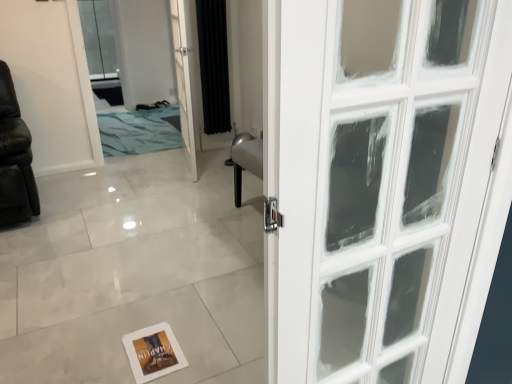
This screenshot has height=384, width=512. Describe the element at coordinates (183, 82) in the screenshot. I see `white glass door at center` at that location.

The width and height of the screenshot is (512, 384). What do you see at coordinates (99, 39) in the screenshot?
I see `clear glass window at upper left` at bounding box center [99, 39].

In order to click on blue fabric bed at upper left in this screenshot , I will do [x=156, y=59].

Identify the location of white paper postcard at lower center. The height and width of the screenshot is (384, 512). (153, 352).

The height and width of the screenshot is (384, 512). In order to click on white glass door at center in this screenshot , I will do `click(183, 82)`.

Is clear glass window at upper left not close to white glass door at center?

Indeed, clear glass window at upper left is not near white glass door at center.

How different are the orientations of clear glass window at upper left and white glass door at center in degrees?

101 degrees separate the facing orientations of clear glass window at upper left and white glass door at center.

Between clear glass window at upper left and white glass door at center, which one is positioned behind?

clear glass window at upper left is more distant.

From a real-world perspective, between clear glass window at upper left and white glass door at center, who is vertically lower?

From a 3D spatial view, white glass door at center is below.

Is white glass door at center shorter than clear glass window at upper left?

Yes, white glass door at center is shorter than clear glass window at upper left.

Where is `door on the right side of clear glass window at upper left`? The width and height of the screenshot is (512, 384). door on the right side of clear glass window at upper left is located at coordinates (183, 82).

Can you confirm if white glass door at center is smaller than clear glass window at upper left?

No, white glass door at center is not smaller than clear glass window at upper left.

Which is in front, point (181, 119) or point (93, 51)?

Positioned in front is point (181, 119).

Can you tell me how much white paper postcard at lower center and black fabric curtain at center differ in facing direction?

They differ by 180 degrees in their facing directions.

Considering the sizes of white paper postcard at lower center and black fabric curtain at center in the image, is white paper postcard at lower center wider or thinner than black fabric curtain at center?

Considering their sizes, white paper postcard at lower center looks broader than black fabric curtain at center.

Who is bigger, white paper postcard at lower center or black fabric curtain at center?

With larger size is black fabric curtain at center.

Are white paper postcard at lower center and black fabric curtain at center far apart?

Indeed, white paper postcard at lower center is not near black fabric curtain at center.

From the image's perspective, between black fabric curtain at center and white glass door at center, which one is located above?

From the image's view, black fabric curtain at center is above.

Considering the sizes of objects black fabric curtain at center and white glass door at center in the image provided, who is wider, black fabric curtain at center or white glass door at center?

white glass door at center is wider.

Is black fabric curtain at center facing towards white glass door at center?

No, black fabric curtain at center does not turn towards white glass door at center.

Consider the image. From a real-world perspective, does black fabric curtain at center sit lower than white glass door at center?

Incorrect, from a real-world perspective, black fabric curtain at center is higher than white glass door at center.

Based on the photo, is white glass door at center positioned far away from black fabric curtain at center?

Actually, white glass door at center and black fabric curtain at center are a little close together.

From the picture: Who is smaller, white glass door at center or black fabric curtain at center?

With smaller size is black fabric curtain at center.

Consider the image. How different are the orientations of white glass door at center and black fabric curtain at center in degrees?

There is a 101-degree angle between the facing directions of white glass door at center and black fabric curtain at center.

You are a GUI agent. You are given a task and a screenshot of the screen. Output one action in this format:
    pyautogui.click(x=<x>, y=<y>)
    Task: Click on the door below the black fabric curtain at center (from the image's perspective)
    Image resolution: width=512 pixels, height=384 pixels.
    Given the screenshot: What is the action you would take?
    pyautogui.click(x=183, y=82)

Does clear glass window at upper left have a lesser height compared to black fabric curtain at center?

No, clear glass window at upper left is not shorter than black fabric curtain at center.

From the image's perspective, would you say clear glass window at upper left is positioned over black fabric curtain at center?

Yes, from the image's perspective, clear glass window at upper left is over black fabric curtain at center.

In the scene shown: Is clear glass window at upper left at the left side of black fabric curtain at center?

Yes, clear glass window at upper left is to the left of black fabric curtain at center.

From a real-world perspective, who is located lower, clear glass window at upper left or black fabric curtain at center?

In real-world perspective, clear glass window at upper left is lower.

From a real-world perspective, between black fabric curtain at center and white paper postcard at lower center, who is vertically higher?

In real-world perspective, black fabric curtain at center is above.

Is black fabric curtain at center smaller than white paper postcard at lower center?

No, black fabric curtain at center is not smaller than white paper postcard at lower center.

Which object is wider, black fabric curtain at center or white paper postcard at lower center?

With larger width is white paper postcard at lower center.

The image size is (512, 384). I want to click on window behind the white glass door at center, so click(99, 39).

Image resolution: width=512 pixels, height=384 pixels. In order to click on door in front of the clear glass window at upper left in this screenshot , I will do `click(183, 82)`.

When comparing their distances from clear glass window at upper left, does white paper postcard at lower center or black fabric curtain at center seem further?

white paper postcard at lower center is positioned further to the anchor clear glass window at upper left.

Based on their spatial positions, is clear glass window at upper left or white paper postcard at lower center further from black fabric curtain at center?

clear glass window at upper left.

Looking at the image, which one is located closer to clear glass window at upper left, white glass door at center or blue fabric bed at upper left?

blue fabric bed at upper left is closer to clear glass window at upper left.

Looking at the image, which one is located closer to blue fabric bed at upper left, white glass door at center or black fabric curtain at center?

black fabric curtain at center lies closer to blue fabric bed at upper left than the other object.

Based on their spatial positions, is black fabric curtain at center or white glass door at center closer to white paper postcard at lower center?

The object closer to white paper postcard at lower center is white glass door at center.

Looking at the image, which one is located closer to white paper postcard at lower center, clear glass window at upper left or white glass door at center?

white glass door at center lies closer to white paper postcard at lower center than the other object.

From the image, which object appears to be nearer to black fabric curtain at center, white paper postcard at lower center or blue fabric bed at upper left?

blue fabric bed at upper left is closer to black fabric curtain at center.

From the picture: Considering their positions, is clear glass window at upper left positioned further to blue fabric bed at upper left than white glass door at center?

white glass door at center is further to blue fabric bed at upper left.

Where is `curtain between blue fabric bed at upper left and clear glass window at upper left from front to back`? The image size is (512, 384). curtain between blue fabric bed at upper left and clear glass window at upper left from front to back is located at coordinates (213, 65).

The image size is (512, 384). Find the location of `door positioned between white paper postcard at lower center and black fabric curtain at center from near to far`. door positioned between white paper postcard at lower center and black fabric curtain at center from near to far is located at coordinates (183, 82).

Find the location of a particular element. door positioned between white paper postcard at lower center and clear glass window at upper left from near to far is located at coordinates point(183,82).

Find the location of a particular element. This screenshot has height=384, width=512. elevator between white glass door at center and black fabric curtain at center from front to back is located at coordinates (156, 59).